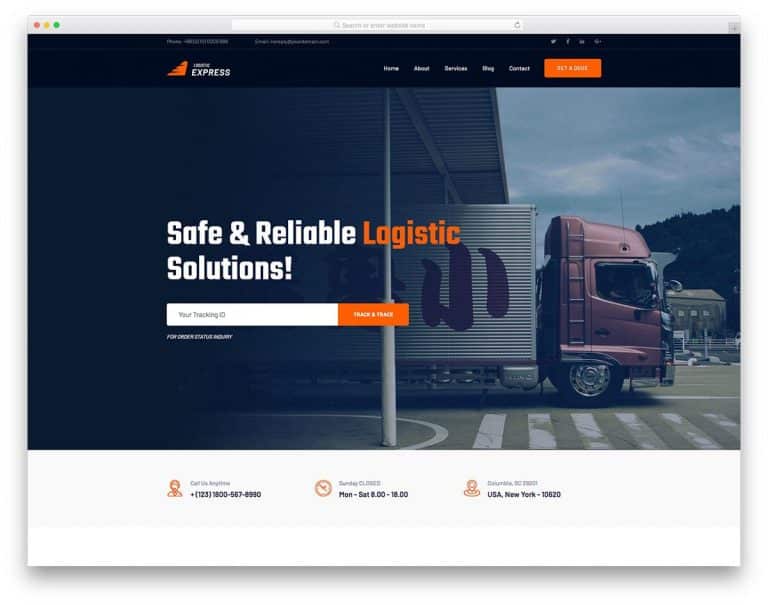
You are a GUI agent. You are given a task and a screenshot of the screen. Output one action in this format:
    pyautogui.click(x=<x>, y=<y>)
    Task: Click on the window
    This screenshot has height=605, width=768.
    Given the screenshot: What is the action you would take?
    pyautogui.click(x=631, y=285)